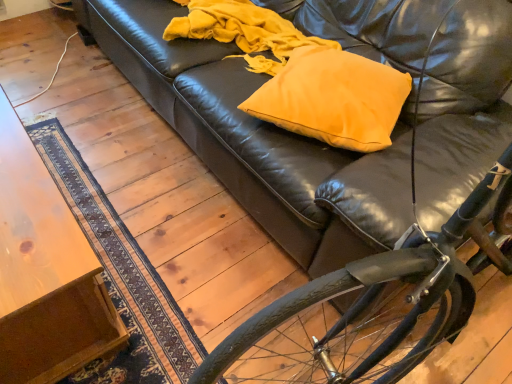
Question: Can you confirm if matte yellow pillow at center is smaller than shiny black bicycle at lower right?

Choices:
 (A) yes
 (B) no

Answer: (A)

Question: Can you confirm if matte yellow pillow at center is positioned to the right of shiny black bicycle at lower right?

Choices:
 (A) yes
 (B) no

Answer: (B)

Question: Considering the relative sizes of matte yellow pillow at center and shiny black bicycle at lower right in the image provided, is matte yellow pillow at center thinner than shiny black bicycle at lower right?

Choices:
 (A) no
 (B) yes

Answer: (B)

Question: Is matte yellow pillow at center closer to the viewer compared to shiny black bicycle at lower right?

Choices:
 (A) no
 (B) yes

Answer: (A)

Question: From a real-world perspective, is matte yellow pillow at center beneath shiny black bicycle at lower right?

Choices:
 (A) yes
 (B) no

Answer: (A)

Question: From the image's perspective, is matte yellow pillow at center located above or below shiny black bicycle at lower right?

Choices:
 (A) above
 (B) below

Answer: (A)

Question: Does point (406, 82) appear closer or farther from the camera than point (439, 317)?

Choices:
 (A) closer
 (B) farther

Answer: (B)

Question: Is matte yellow pillow at center to the left or to the right of shiny black bicycle at lower right in the image?

Choices:
 (A) right
 (B) left

Answer: (B)

Question: In terms of size, does matte yellow pillow at center appear bigger or smaller than shiny black bicycle at lower right?

Choices:
 (A) big
 (B) small

Answer: (B)

Question: Considering the positions of wooden table at lower left and matte yellow pillow at center in the image, is wooden table at lower left wider or thinner than matte yellow pillow at center?

Choices:
 (A) thin
 (B) wide

Answer: (B)

Question: Is wooden table at lower left inside the boundaries of matte yellow pillow at center, or outside?

Choices:
 (A) inside
 (B) outside

Answer: (B)

Question: From a real-world perspective, is wooden table at lower left positioned above or below matte yellow pillow at center?

Choices:
 (A) below
 (B) above

Answer: (A)

Question: Considering their positions, is wooden table at lower left located in front of or behind matte yellow pillow at center?

Choices:
 (A) behind
 (B) front

Answer: (B)

Question: Is shiny black bicycle at lower right bigger or smaller than matte yellow pillow at center?

Choices:
 (A) small
 (B) big

Answer: (B)

Question: In terms of width, does shiny black bicycle at lower right look wider or thinner when compared to matte yellow pillow at center?

Choices:
 (A) thin
 (B) wide

Answer: (B)